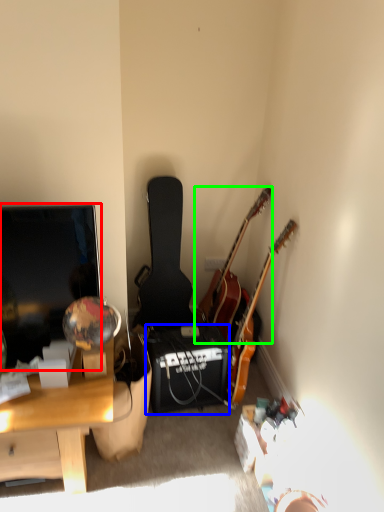
Question: Estimate the real-world distances between objects in this image. Which object is closer to television (highlighted by a red box), loudspeaker (highlighted by a blue box) or guitar (highlighted by a green box)?

Choices:
 (A) loudspeaker
 (B) guitar

Answer: (A)